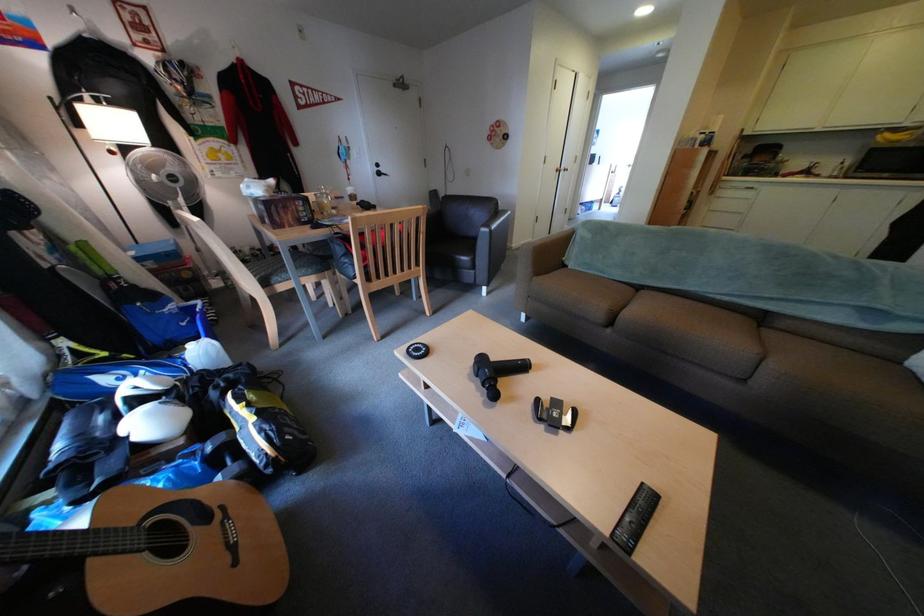
I want to click on sofa sitting surface, so click(x=720, y=334).